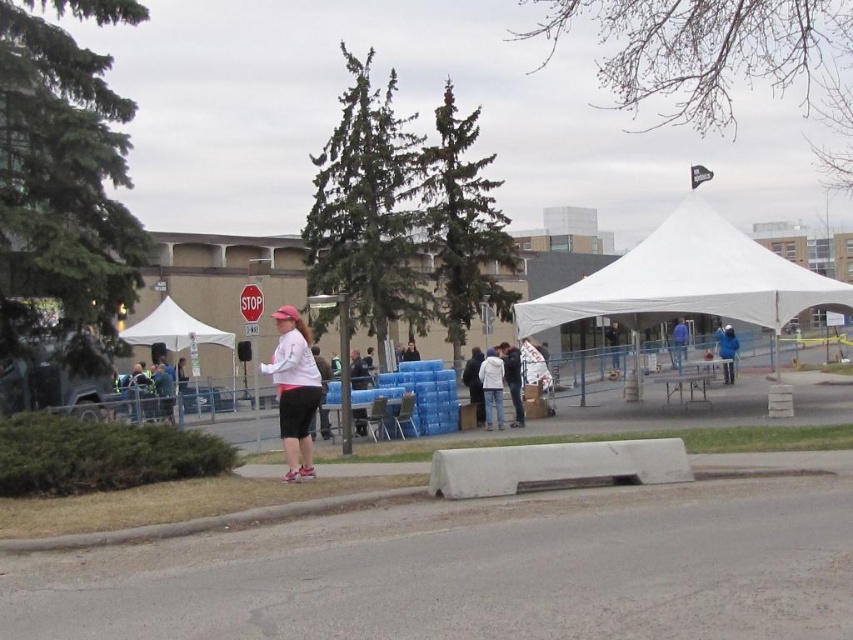
You are organizing a community event and need to retrieve the white cotton jacket at center from under the dark blue jacket at center. What is the first step you should take?

The white cotton jacket at center is positioned over the dark blue jacket at center, so you should first remove the white cotton jacket at center to access the dark blue jacket at center.

You are a photographer positioned at the edge of the sidewalk. You want to take a photo of the dark blue jacket at center and the white fabric canopy at center. Which object will appear closer to the front of the photo?

The white fabric canopy at center will appear closer to the front of the photo because the dark blue jacket at center is behind it.

You are planning to set up a temporary structure for an event. You have a white fabric canopy at center and a dark blue jacket at center. Which item is narrower in width?

The white fabric canopy at center is thinner than the dark blue jacket at center, so the white fabric canopy at center is narrower in width.